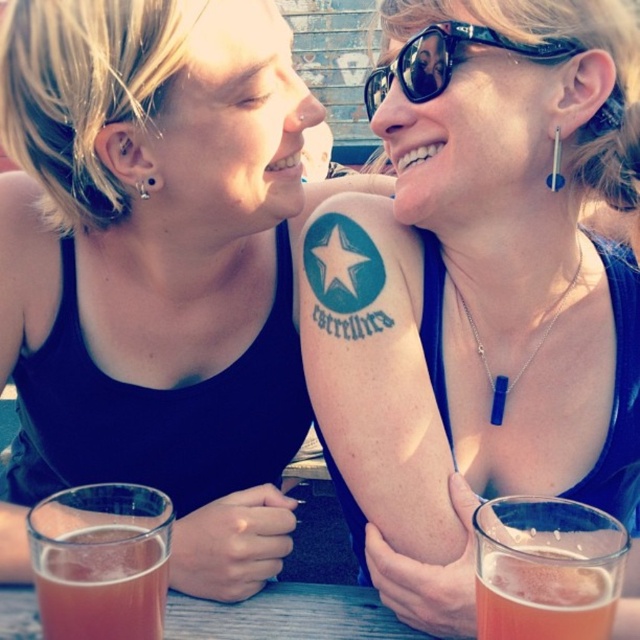
Question: Among these points, which one is farthest from the camera?

Choices:
 (A) tap(435, 35)
 (B) tap(442, 588)
 (C) tap(4, 276)

Answer: (C)

Question: Is matte black tank top at upper center positioned before black plastic sunglasses at upper right?

Choices:
 (A) yes
 (B) no

Answer: (A)

Question: Which object appears closest to the camera in this image?

Choices:
 (A) matte black tank top at upper center
 (B) matte black tank top at upper left
 (C) black plastic sunglasses at upper right

Answer: (A)

Question: Which of the following is the farthest from the observer?

Choices:
 (A) black plastic sunglasses at upper right
 (B) translucent glass at lower left
 (C) matte black tank top at upper center
 (D) matte black tank top at upper left

Answer: (D)

Question: Is matte black tank top at upper center to the left of translucent glass at lower left from the viewer's perspective?

Choices:
 (A) yes
 (B) no

Answer: (B)

Question: Can you confirm if matte black tank top at upper left is thinner than translucent glass at lower left?

Choices:
 (A) yes
 (B) no

Answer: (A)